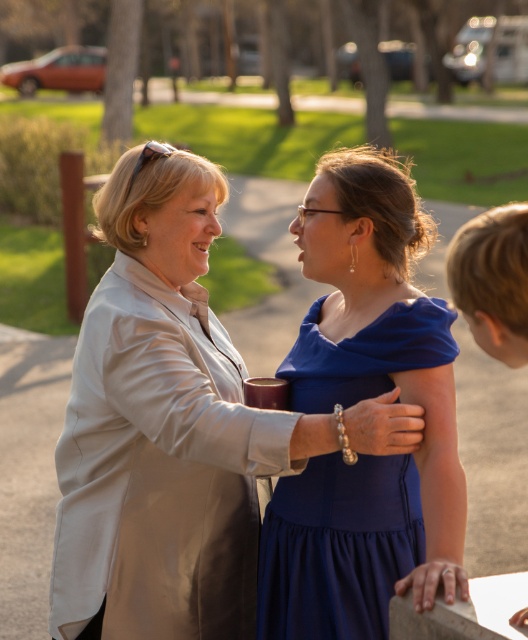
Does satin beige blazer at center lie behind royal blue satin dress at center?

That is False.

Is satin beige blazer at center in front of royal blue satin dress at center?

Yes, it is in front of royal blue satin dress at center.

What do you see at coordinates (163, 429) in the screenshot? I see `satin beige blazer at center` at bounding box center [163, 429].

Where is `satin beige blazer at center`? satin beige blazer at center is located at coordinates (163, 429).